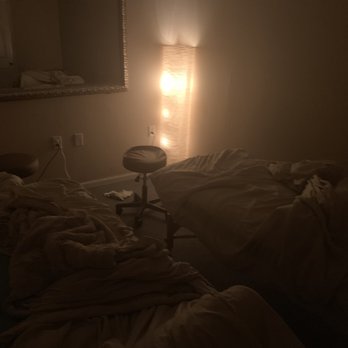
You are a GUI agent. You are given a task and a screenshot of the screen. Output one action in this format:
    pyautogui.click(x=<x>, y=<y>)
    Task: Click on the wall
    The image size is (348, 348).
    Given the screenshot: What is the action you would take?
    pyautogui.click(x=290, y=78)